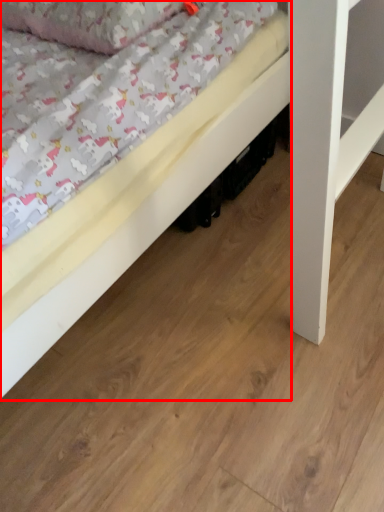
Question: From the image's perspective, where is bed (annotated by the red box) located in relation to pillow in the image?

Choices:
 (A) above
 (B) below

Answer: (B)